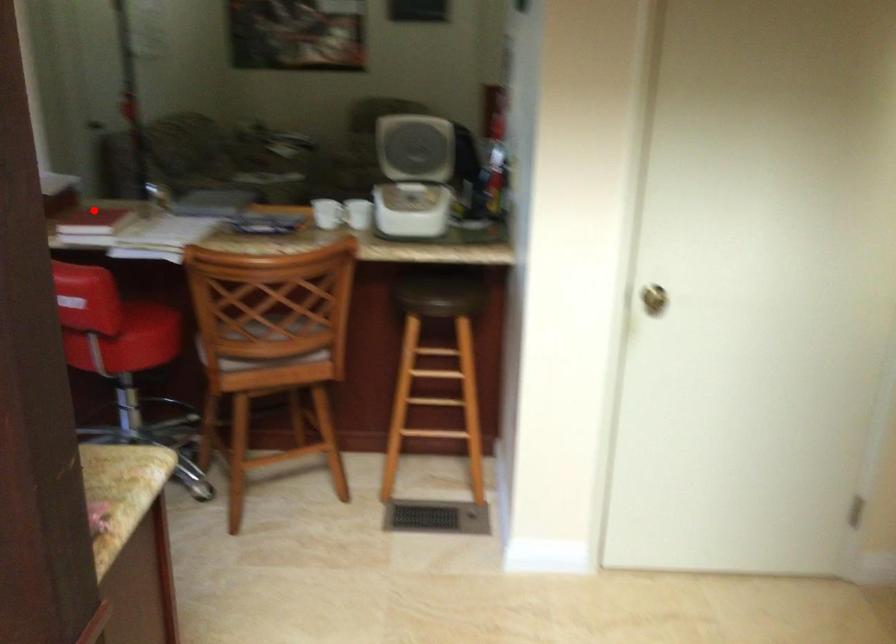
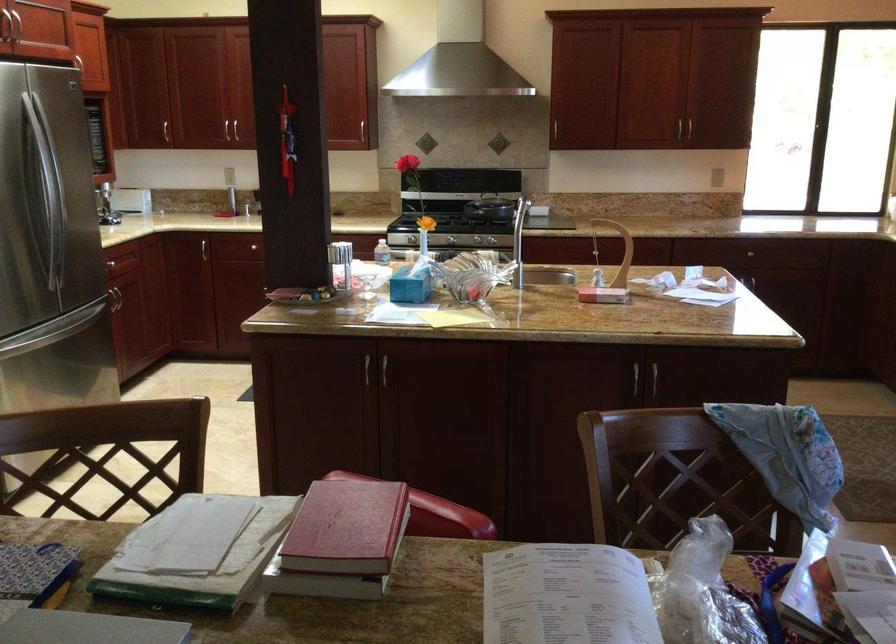
Locate, in the second image, the point that corresponds to the highlighted location in the first image.

(346, 527)